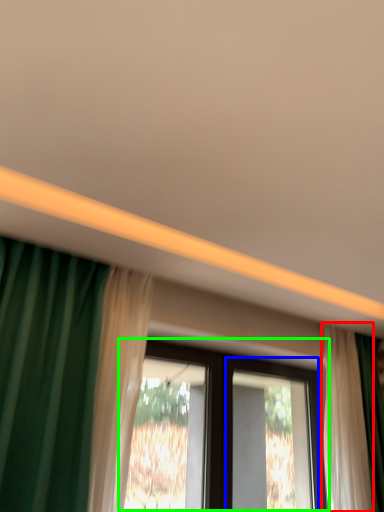
Question: Estimate the real-world distances between objects in this image. Which object is closer to curtain (highlighted by a red box), screen door (highlighted by a blue box) or window (highlighted by a green box)?

Choices:
 (A) screen door
 (B) window

Answer: (B)